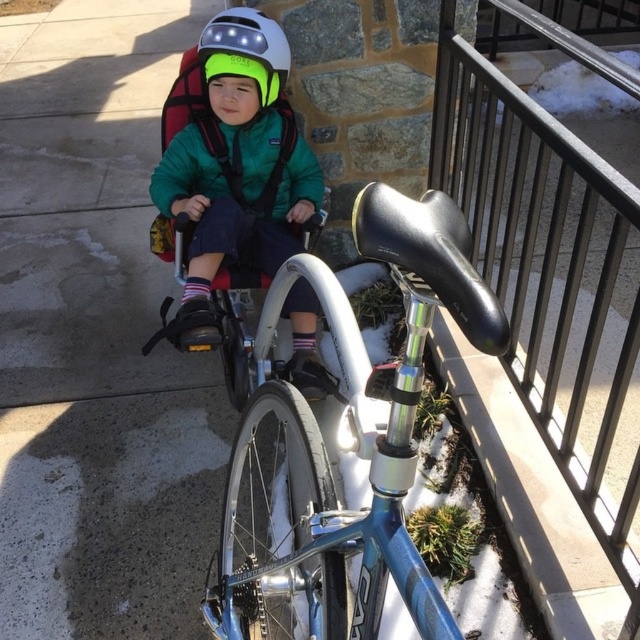
You are a delivery robot that needs to pass through a narrow path between the black metal railing at upper right and the green matte jacket at center. The path is only 1 meter wide. Can you safely navigate through this path if your width is 0.8 meters?

The black metal railing at upper right might be wider than the green matte jacket at center, but since the path is 1 meter wide and the robot is 0.8 meters wide, there is enough space for the robot to pass safely as long as it stays centered between them.

You are a delivery person trying to navigate a narrow path between the black metal railing at upper right and the shiny blue frame at center. Can you pass through without touching either?

The black metal railing at upper right is positioned on the right side of the shiny blue frame at center, so there is space between them. However, the description does not provide specific measurements of the distance between the two objects. Without knowing the exact width of the path or the size of the delivery vehicle, it is impossible to determine if you can pass through without touching either.

You are a delivery person needing to navigate around the black metal railing at upper right and the shiny blue frame at center. Which object should you avoid hitting if you want to pass through the area without obstruction?

The black metal railing at upper right is taller than the shiny blue frame at center, so you should avoid hitting the black metal railing at upper right to pass through the area without obstruction.